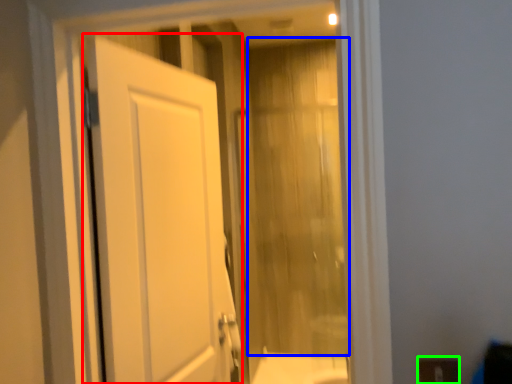
Question: Estimate the real-world distances between objects in this image. Which object is closer to door (highlighted by a red box), curtain (highlighted by a blue box) or electric outlet (highlighted by a green box)?

Choices:
 (A) curtain
 (B) electric outlet

Answer: (B)